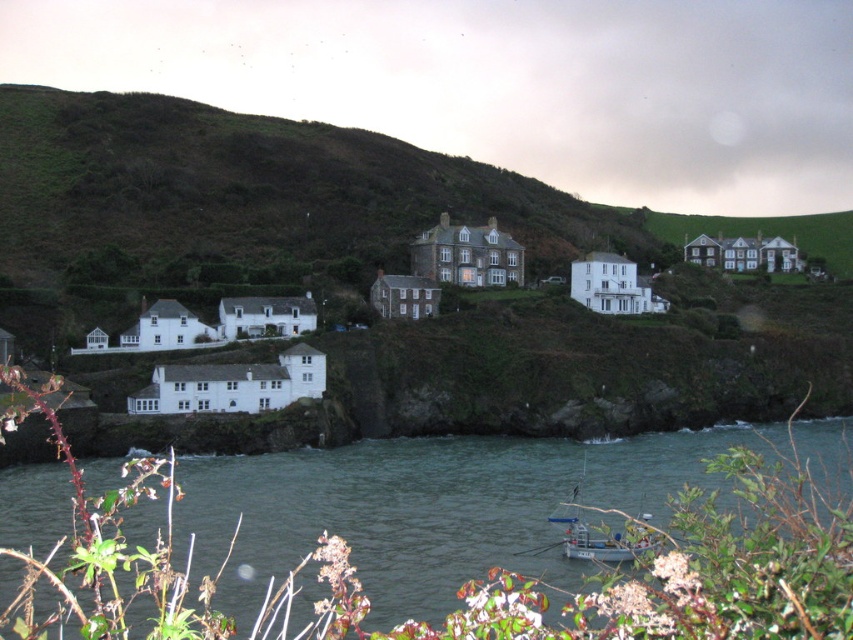
Question: Among these points, which one is farthest from the camera?

Choices:
 (A) (444, 592)
 (B) (714, 262)

Answer: (B)

Question: Can you confirm if white painted wooden houses at center right is wider than metallic gray boat at lower center?

Choices:
 (A) no
 (B) yes

Answer: (B)

Question: Which of the following is the farthest from the observer?

Choices:
 (A) (576, 289)
 (B) (186, 520)
 (C) (561, 550)

Answer: (A)

Question: Is white matte house at center to the right of metallic gray boat at lower center from the viewer's perspective?

Choices:
 (A) no
 (B) yes

Answer: (B)

Question: Is white matte house at center bigger than metallic gray boat at lower center?

Choices:
 (A) yes
 (B) no

Answer: (B)

Question: Among these points, which one is farthest from the camera?

Choices:
 (A) (254, 592)
 (B) (701, 262)

Answer: (B)